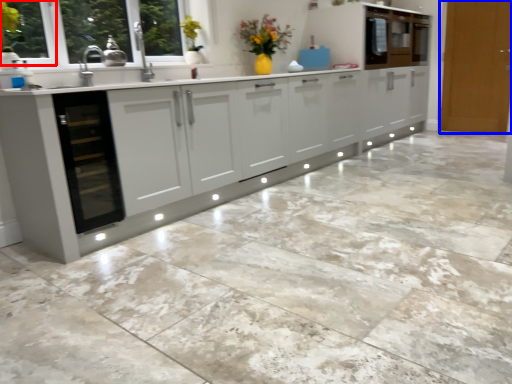
Question: Which object is closer to the camera taking this photo, window frame (highlighted by a red box) or door (highlighted by a blue box)?

Choices:
 (A) window frame
 (B) door

Answer: (A)